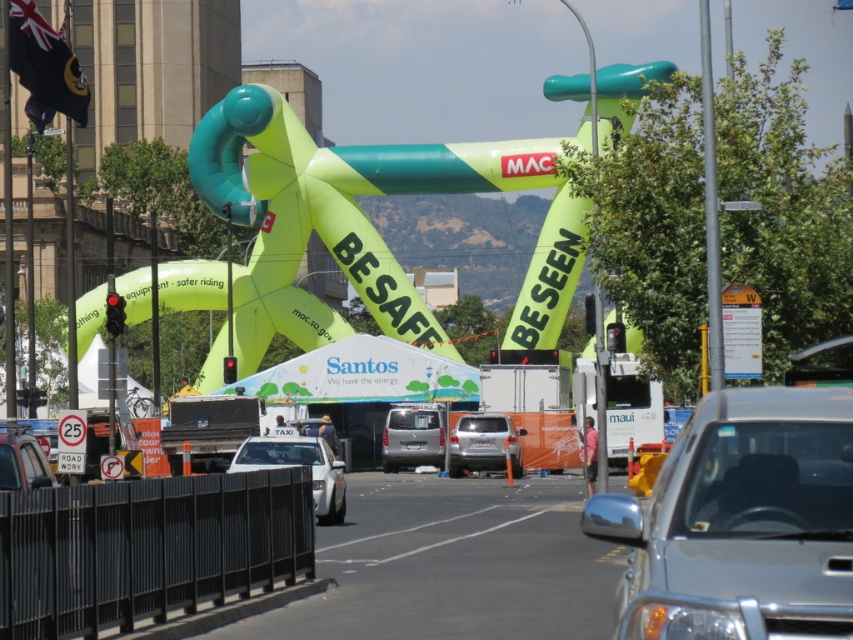
Measure the distance between point (x=366, y=225) and camera.

A distance of 252.01 feet exists between point (x=366, y=225) and camera.

Which is behind, point (254, 339) or point (585, 502)?

The point (254, 339) is behind.

Identify the location of green inflatable bicycle at center. The height and width of the screenshot is (640, 853). (364, 224).

Does white glossy taxi at center appear over silver metallic van at center?

Indeed, white glossy taxi at center is positioned over silver metallic van at center.

Is white glossy taxi at center closer to the viewer compared to silver metallic van at center?

Yes, white glossy taxi at center is closer to the viewer.

Who is more distant from viewer, (317, 516) or (428, 464)?

The point (428, 464) is behind.

Where is `white glossy taxi at center`? This screenshot has width=853, height=640. white glossy taxi at center is located at coordinates (299, 465).

Can you confirm if green inflatable bicycle at center is positioned to the right of orange plastic sign at upper right?

Incorrect, green inflatable bicycle at center is not on the right side of orange plastic sign at upper right.

Between green inflatable bicycle at center and orange plastic sign at upper right, which one appears on the right side from the viewer's perspective?

Positioned to the right is orange plastic sign at upper right.

Find the location of a particular element. This screenshot has width=853, height=640. green inflatable bicycle at center is located at coordinates (364, 224).